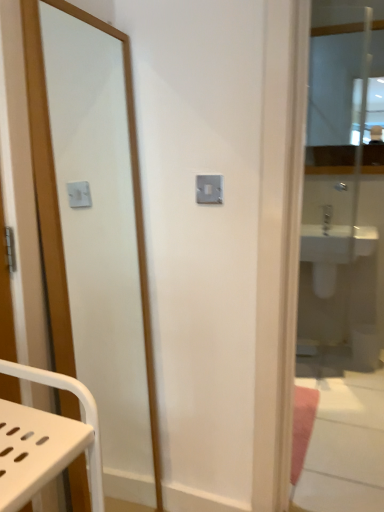
Question: From a real-world perspective, does clear glass mirror at right, which ranks as the 2th mirror in front-to-back order, stand above white glossy sink at right?

Choices:
 (A) no
 (B) yes

Answer: (B)

Question: Is there a large distance between clear glass mirror at right, which ranks as the 2th mirror in front-to-back order, and white glossy sink at right?

Choices:
 (A) no
 (B) yes

Answer: (A)

Question: Is white glossy sink at right completely or partially inside clear glass mirror at right, the second mirror from the left?

Choices:
 (A) no
 (B) yes

Answer: (A)

Question: Considering the relative sizes of clear glass mirror at right, which ranks as the 2th mirror in front-to-back order, and white glossy sink at right in the image provided, is clear glass mirror at right, which ranks as the 2th mirror in front-to-back order, thinner than white glossy sink at right?

Choices:
 (A) yes
 (B) no

Answer: (A)

Question: Does clear glass mirror at right, placed as the 2th mirror when sorted from back to front, lie behind white glossy sink at right?

Choices:
 (A) no
 (B) yes

Answer: (A)

Question: Does point (377, 40) appear closer or farther from the camera than point (114, 110)?

Choices:
 (A) farther
 (B) closer

Answer: (A)

Question: Looking at their shapes, would you say clear glass mirror at upper right, which appears as the third mirror when viewed from the left, is wider or thinner than matte wooden mirror at left, the 1th mirror positioned from the front?

Choices:
 (A) wide
 (B) thin

Answer: (B)

Question: Is clear glass mirror at upper right, which is the third mirror from front to back, in front of or behind matte wooden mirror at left, which is the third mirror in back-to-front order, in the image?

Choices:
 (A) front
 (B) behind

Answer: (B)

Question: Is clear glass mirror at upper right, which appears as the third mirror when viewed from the left, taller or shorter than matte wooden mirror at left, acting as the first mirror starting from the left?

Choices:
 (A) short
 (B) tall

Answer: (A)

Question: Is matte wooden mirror at left, which is the third mirror in right-to-left order, to the left or to the right of clear glass mirror at right, which ranks as the 2th mirror in front-to-back order, in the image?

Choices:
 (A) left
 (B) right

Answer: (A)

Question: From a real-world perspective, is matte wooden mirror at left, acting as the first mirror starting from the left, above or below clear glass mirror at right, which ranks as the 2th mirror in front-to-back order?

Choices:
 (A) below
 (B) above

Answer: (A)

Question: In terms of height, does matte wooden mirror at left, acting as the first mirror starting from the left, look taller or shorter compared to clear glass mirror at right, placed as the second mirror when sorted from right to left?

Choices:
 (A) tall
 (B) short

Answer: (B)

Question: Considering the positions of matte wooden mirror at left, which is the third mirror in back-to-front order, and clear glass mirror at right, placed as the second mirror when sorted from right to left, in the image, is matte wooden mirror at left, which is the third mirror in back-to-front order, wider or thinner than clear glass mirror at right, placed as the second mirror when sorted from right to left,?

Choices:
 (A) wide
 (B) thin

Answer: (A)

Question: In terms of width, does white glossy sink at right look wider or thinner when compared to clear glass mirror at right, the second mirror from the left?

Choices:
 (A) thin
 (B) wide

Answer: (B)

Question: Is white glossy sink at right bigger or smaller than clear glass mirror at right, placed as the second mirror when sorted from right to left?

Choices:
 (A) big
 (B) small

Answer: (A)